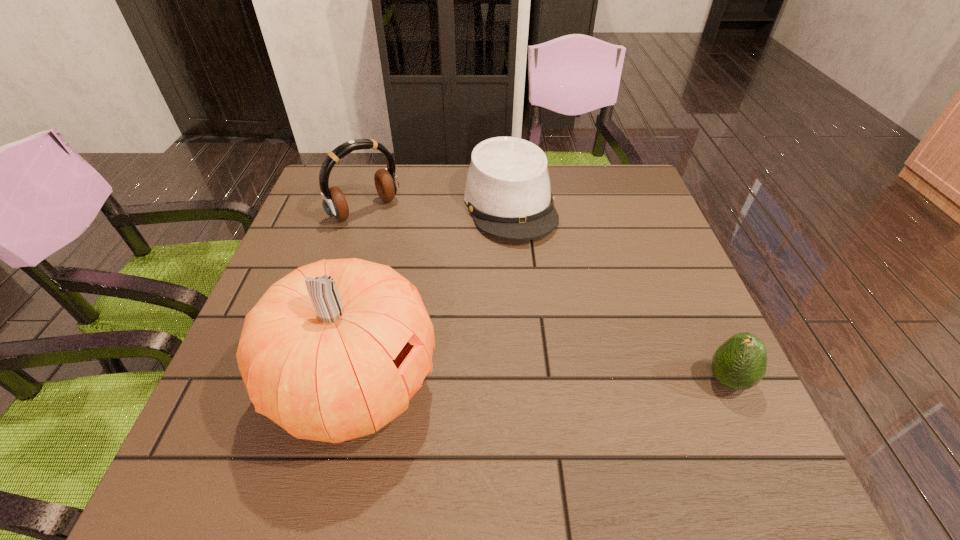
Locate an element on the screen. The height and width of the screenshot is (540, 960). vacant space that satisfies the following two spatial constraints: 1. on the front side of the hat; 2. on the left side of the rightmost object is located at coordinates [x=524, y=381].